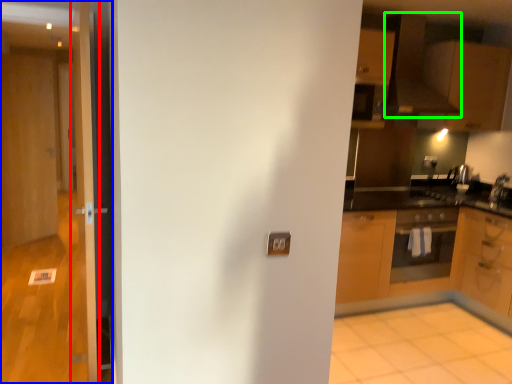
Question: Which object is positioned farthest from door (highlighted by a red box)? Select from door (highlighted by a blue box) and exhaust hood (highlighted by a green box).

Choices:
 (A) door
 (B) exhaust hood

Answer: (B)